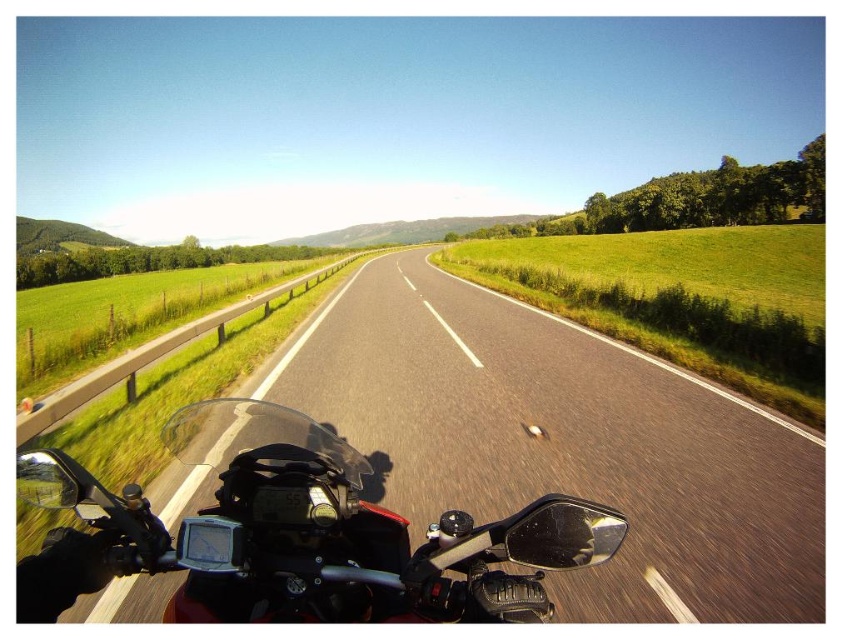
Who is more distant from viewer, (587, 381) or (248, 620)?

Positioned behind is point (587, 381).

What do you see at coordinates (563, 442) in the screenshot?
I see `asphalt road at center` at bounding box center [563, 442].

Between point (641, 566) and point (406, 621), which one is positioned in front?

Point (406, 621)

I want to click on asphalt road at center, so click(x=563, y=442).